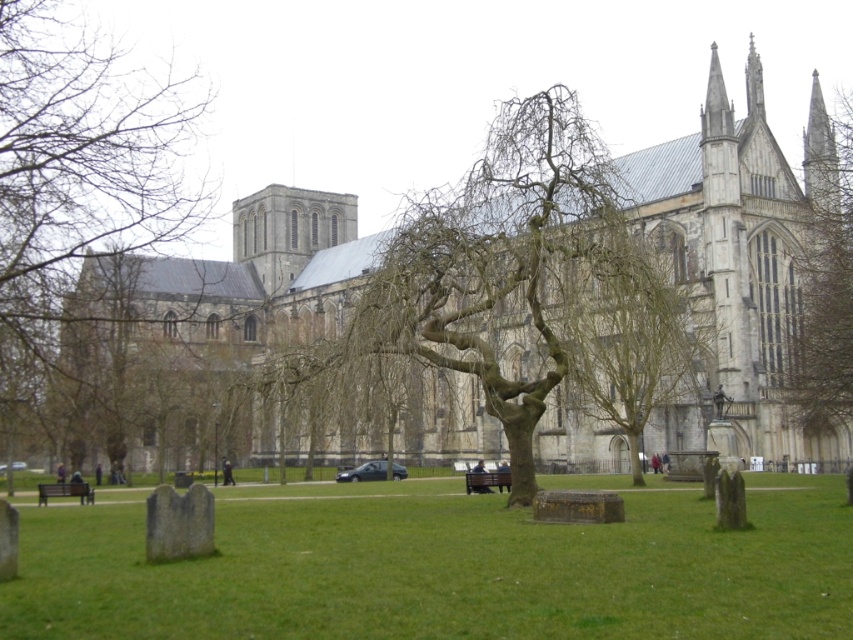
Is bare wood tree at center above wooden bench at lower left?

Indeed, bare wood tree at center is positioned over wooden bench at lower left.

Is bare wood tree at center to the right of wooden bench at lower left from the viewer's perspective?

Indeed, bare wood tree at center is positioned on the right side of wooden bench at lower left.

Is point (584, 330) more distant than point (80, 483)?

No, it is not.

Find the location of a particular element. bare wood tree at center is located at coordinates coord(627,336).

Between bare branches at left and bare wood tree at center, which one appears on the left side from the viewer's perspective?

bare branches at left

How far apart are bare branches at left and bare wood tree at center?

The distance of bare branches at left from bare wood tree at center is 41.20 meters.

Image resolution: width=853 pixels, height=640 pixels. What do you see at coordinates (78, 173) in the screenshot? I see `bare branches at left` at bounding box center [78, 173].

Where is `bare branches at left`? This screenshot has width=853, height=640. bare branches at left is located at coordinates (78, 173).

Measure the distance between green grass at lower center and bare branches at right.

The distance of green grass at lower center from bare branches at right is 24.89 meters.

Does green grass at lower center have a lesser height compared to bare branches at right?

Indeed, green grass at lower center has a lesser height compared to bare branches at right.

Find the location of a particular element. The height and width of the screenshot is (640, 853). green grass at lower center is located at coordinates (445, 566).